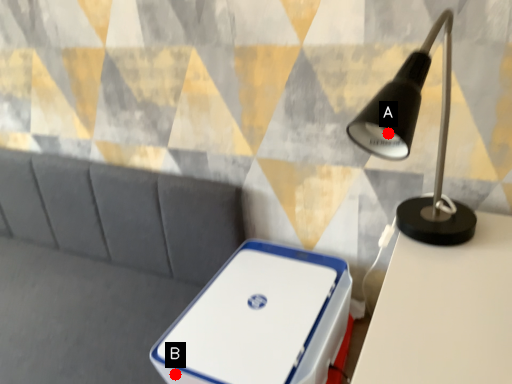
Question: Two points are circled on the image, labeled by A and B beside each circle. Which of the following is the farthest from the observer?

Choices:
 (A) A is further
 (B) B is further

Answer: (B)